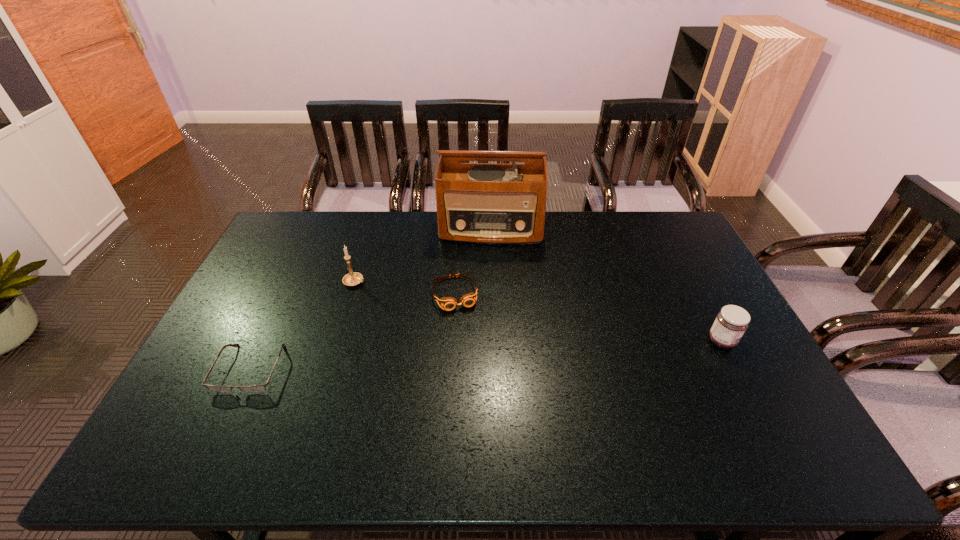
Where is `free location that satisfies the following two spatial constraints: 1. on the front side of the rightmost object; 2. on the front label of the farthest object`? free location that satisfies the following two spatial constraints: 1. on the front side of the rightmost object; 2. on the front label of the farthest object is located at coordinates (495, 341).